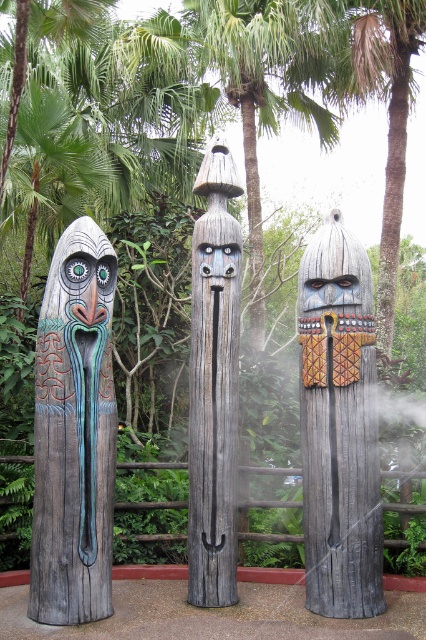
You are an art curator planning to display the wooden totem at center and the matte wood mask at left in a narrow hallway. Given their widths, which one should you place first to ensure they fit side by side without overlapping?

The wooden totem at center is wider than the matte wood mask at left, so you should place the matte wood mask at left first to accommodate the wider wooden totem at center next without overlapping.

You are standing in front of the three statues and want to touch both point [351,368] and point [230,314]. Which point should you reach for first to touch the closer one?

Point [351,368] is closer to the viewer than point [230,314], so you should reach for point [351,368] first.

You are an art conservator assessing the statues in the tropical setting. You need to determine which object is taller between the carved wood totem at left and the matte wood mask at left. Which one is taller?

The carved wood totem at left is taller than the matte wood mask at left according to the description.